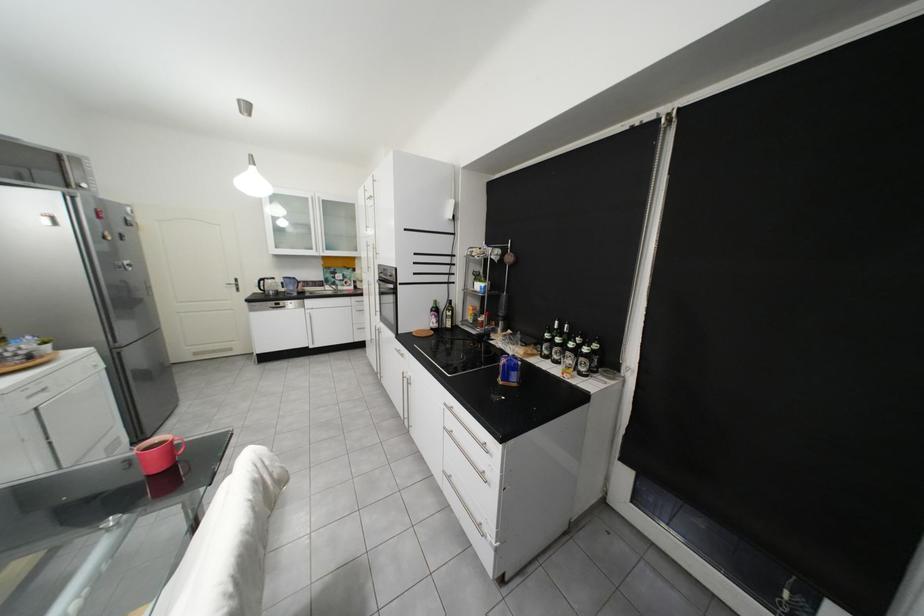
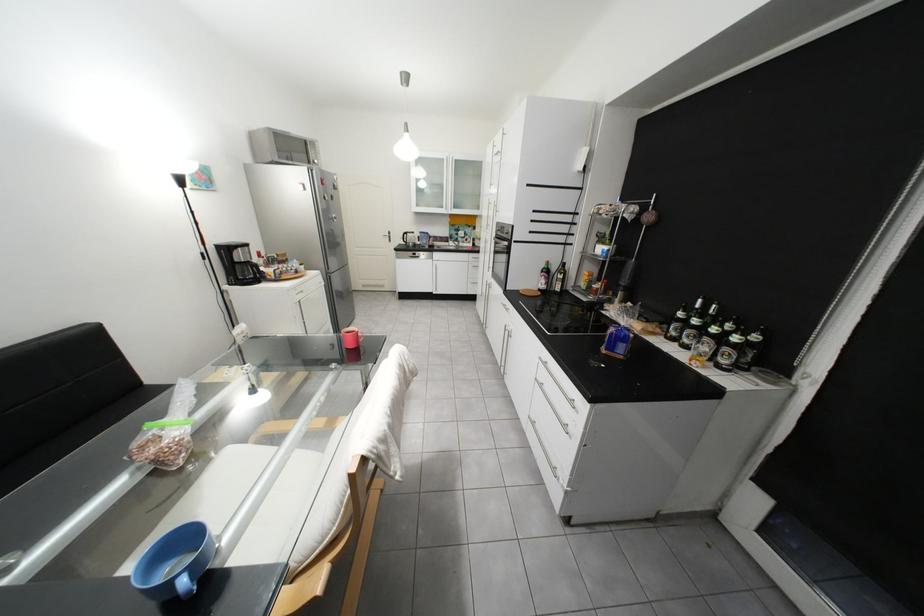
Question: In a continuous first-person perspective shot, in which direction is the camera moving?

Choices:
 (A) Left
 (B) Right
 (C) Forward
 (D) Backward

Answer: (D)